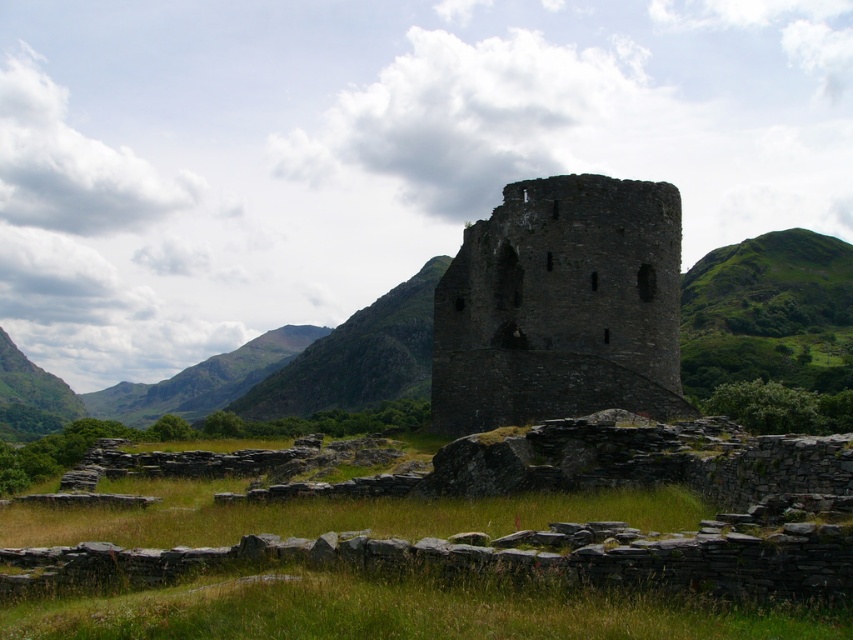
You are standing at the base of the medieval stone structure and want to reach the point marked as point (804, 456) first before going to point (628, 182). Which direction should you move towards first?

You should move towards the direction of point (804, 456) first since it is closer to you than point (628, 182) according to the coordinates provided.